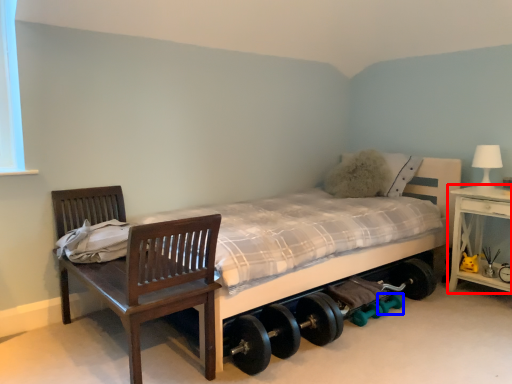
Question: Among these objects, which one is farthest to the camera, nightstand (highlighted by a red box) or dumbbell (highlighted by a blue box)?

Choices:
 (A) nightstand
 (B) dumbbell

Answer: (B)